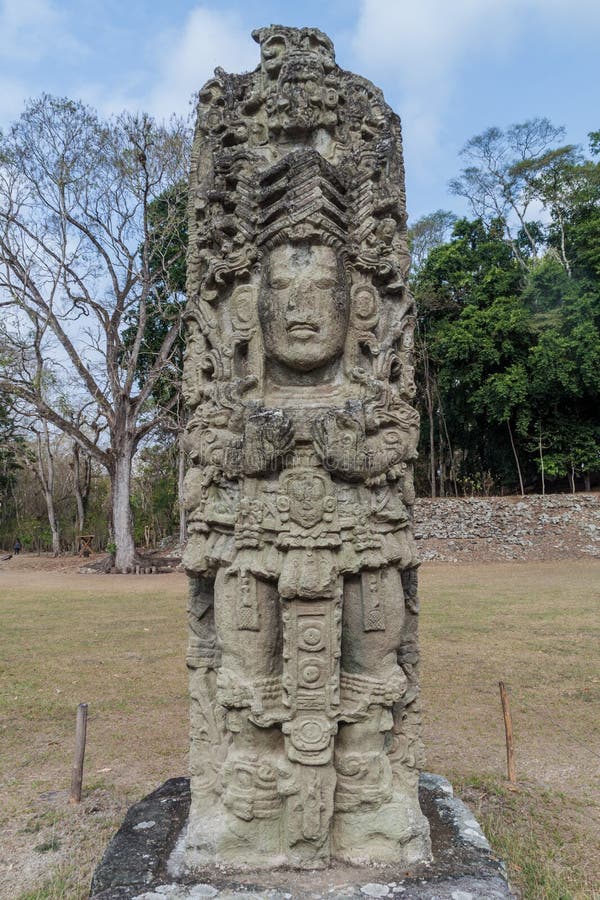
Where is `statue arm`? The width and height of the screenshot is (600, 900). statue arm is located at coordinates (386, 452), (207, 448).